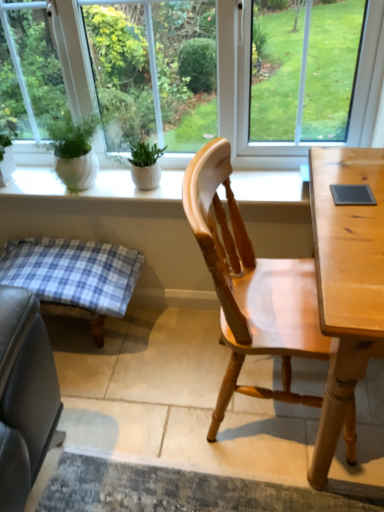
This screenshot has height=512, width=384. What do you see at coordinates (74, 277) in the screenshot? I see `blue plaid cushion at lower left` at bounding box center [74, 277].

The height and width of the screenshot is (512, 384). Identify the location of white ceramic plant pots at upper center. (94, 186).

In order to face light wood chair at center, should I rotate leftwards or rightwards?

You should look right and rotate roughly 10.760 degrees.

This screenshot has width=384, height=512. Describe the element at coordinates (243, 93) in the screenshot. I see `transparent glass window at center` at that location.

This screenshot has height=512, width=384. In order to click on green matte plant at center in this screenshot , I will do `click(145, 165)`.

Is blue plaid cushion at lower left located outside transparent glass window at center?

Yes, blue plaid cushion at lower left is not within transparent glass window at center.

Consider the image. Which object is further away from the camera, blue plaid cushion at lower left or transparent glass window at center?

blue plaid cushion at lower left.

Considering the relative sizes of blue plaid cushion at lower left and transparent glass window at center in the image provided, is blue plaid cushion at lower left smaller than transparent glass window at center?

Yes.

What's the angular difference between blue plaid cushion at lower left and transparent glass window at center's facing directions?

The angular difference between blue plaid cushion at lower left and transparent glass window at center is 1.53 degrees.

Is point (83, 108) farther from viewer compared to point (298, 259)?

That is False.

What's the angular difference between transparent glass window at center and light wood chair at center's facing directions?

The angle between the facing direction of transparent glass window at center and the facing direction of light wood chair at center is 87.5 degrees.

Which of these two, transparent glass window at center or light wood chair at center, is wider?

light wood chair at center.

From a real-world perspective, between transparent glass window at center and light wood chair at center, who is vertically lower?

In real-world perspective, light wood chair at center is lower.

How distant is light wood chair at center from white ceramic plant pots at upper center?

47.14 centimeters.

Is light wood chair at center shorter than white ceramic plant pots at upper center?

In fact, light wood chair at center may be taller than white ceramic plant pots at upper center.

Is light wood chair at center surrounding white ceramic plant pots at upper center?

That's incorrect, white ceramic plant pots at upper center is not inside light wood chair at center.

From a real-world perspective, is light wood chair at center on white ceramic plant pots at upper center?

Actually, light wood chair at center is physically below white ceramic plant pots at upper center in the real world.

Locate an element on the screen. This screenshot has width=384, height=512. window on the left of light wood chair at center is located at coordinates (243, 93).

From the image's perspective, is light wood chair at center above transparent glass window at center?

Actually, light wood chair at center appears below transparent glass window at center in the image.

Consider the image. Relative to transparent glass window at center, is light wood chair at center in front or behind?

light wood chair at center is in front of transparent glass window at center.

Which is more distant, (193,170) or (1,6)?

The point (1,6) is farther from the camera.

Which point is more forward, (210, 441) or (95, 290)?

The point (210, 441) is closer to the camera.

Can we say light wood chair at center lies outside blue plaid cushion at lower left?

Yes, light wood chair at center is located beyond the bounds of blue plaid cushion at lower left.

Which of these two, light wood chair at center or blue plaid cushion at lower left, is smaller?

Smaller between the two is blue plaid cushion at lower left.

Is the position of light wood chair at center more distant than that of blue plaid cushion at lower left?

No, it is in front of blue plaid cushion at lower left.

At what (x,y) coordinates should I click in order to perform the action: click on window sill lying behind the transparent glass window at center. Please return your answer as a coordinate pair (x, y). Looking at the image, I should click on (94, 186).

Is white ceramic plant pots at upper center inside the boundaries of transparent glass window at center, or outside?

white ceramic plant pots at upper center is located beyond the bounds of transparent glass window at center.

Does white ceramic plant pots at upper center lie in front of transparent glass window at center?

No, it is not.

Is white ceramic plant pots at upper center taller or shorter than transparent glass window at center?

Considering their sizes, white ceramic plant pots at upper center has less height than transparent glass window at center.

Based on the photo, can you tell me how much green matte plant at center and transparent glass window at center differ in facing direction?

green matte plant at center and transparent glass window at center are facing 2.55 degrees away from each other.

Could you tell me if green matte plant at center is facing transparent glass window at center?

No, green matte plant at center is not turned towards transparent glass window at center.

Is green matte plant at center not within transparent glass window at center?

Yes, green matte plant at center is located beyond the bounds of transparent glass window at center.

Considering the positions of points (147, 145) and (367, 123), is point (147, 145) closer to camera compared to point (367, 123)?

No, (147, 145) is behind (367, 123).

I want to click on window above the blue plaid cushion at lower left (from a real-world perspective), so click(243, 93).

At what (x,y) coordinates should I click in order to perform the action: click on chair on the right of transparent glass window at center. Please return your answer as a coordinate pair (x, y). The image size is (384, 512). Looking at the image, I should click on (250, 286).

Based on their spatial positions, is white ceramic plant pots at upper center or green matte plant at center further from blue plaid cushion at lower left?

green matte plant at center.

From the image, which object appears to be farther from transparent glass window at center, green matte plant at center or white ceramic plant pots at upper center?

Based on the image, green matte plant at center appears to be further to transparent glass window at center.

Estimate the real-world distances between objects in this image. Which object is further from light wood chair at center, white ceramic plant pots at upper center or green matte plant at center?

Based on the image, green matte plant at center appears to be further to light wood chair at center.

When comparing their distances from light wood chair at center, does white ceramic plant pots at upper center or blue plaid cushion at lower left seem closer?

white ceramic plant pots at upper center is closer to light wood chair at center.

Based on their spatial positions, is blue plaid cushion at lower left or light wood chair at center further from green matte plant at center?

light wood chair at center.

Considering their positions, is blue plaid cushion at lower left positioned closer to transparent glass window at center than white ceramic plant pots at upper center?

white ceramic plant pots at upper center lies closer to transparent glass window at center than the other object.

Considering their positions, is green matte plant at center positioned further to white ceramic plant pots at upper center than transparent glass window at center?

transparent glass window at center is further to white ceramic plant pots at upper center.

From the image, which object appears to be farther from light wood chair at center, transparent glass window at center or green matte plant at center?

Among the two, green matte plant at center is located further to light wood chair at center.

I want to click on window sill between transparent glass window at center and blue plaid cushion at lower left from top to bottom, so click(x=94, y=186).

Find the location of `table positioned between light wood chair at center and green matte plant at center from near to far`. table positioned between light wood chair at center and green matte plant at center from near to far is located at coordinates tap(74, 277).

Identify the location of table between transparent glass window at center and light wood chair at center from top to bottom. The height and width of the screenshot is (512, 384). (74, 277).

This screenshot has height=512, width=384. What are the coordinates of `houseplant between transparent glass window at center and light wood chair at center in the vertical direction` in the screenshot? It's located at point(145,165).